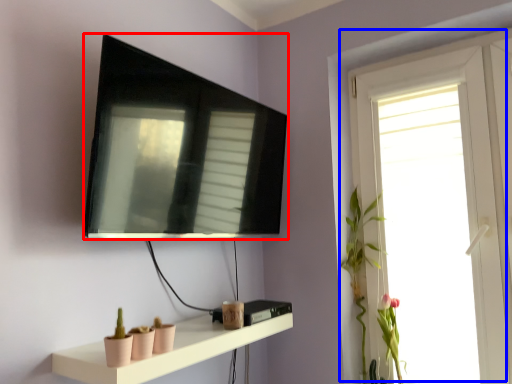
Question: Which object is closer to the camera taking this photo, television (highlighted by a red box) or window (highlighted by a blue box)?

Choices:
 (A) television
 (B) window

Answer: (A)